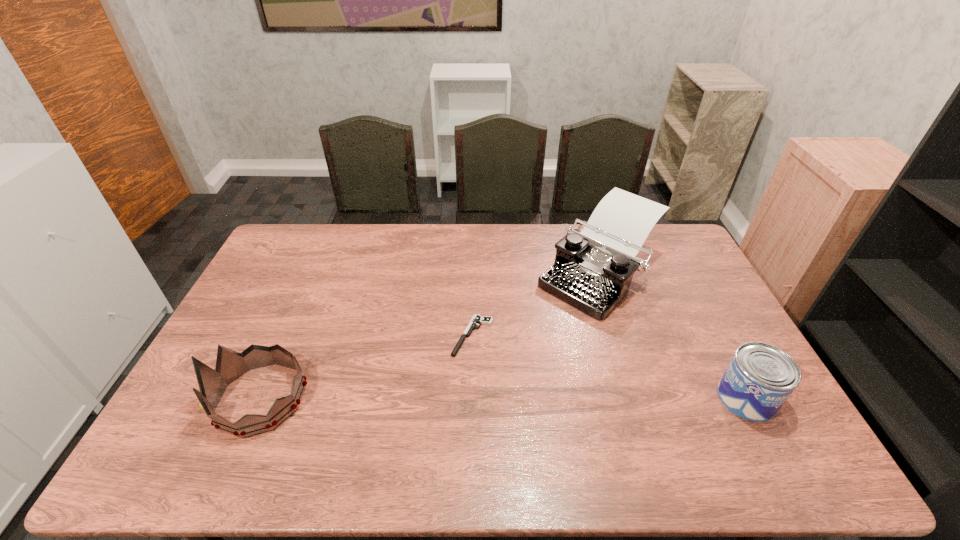
Image resolution: width=960 pixels, height=540 pixels. Find the location of `object present at the near right corner`. object present at the near right corner is located at coordinates (759, 379).

This screenshot has height=540, width=960. Identify the location of vacant area at the far edge of the desktop. (552, 261).

Find the location of a particular element. Image resolution: width=960 pixels, height=540 pixels. blank space at the near edge is located at coordinates (572, 420).

This screenshot has width=960, height=540. In the image, there is a desktop. Find the location of `vacant space at the right edge`. vacant space at the right edge is located at coordinates (667, 299).

You are a GUI agent. You are given a task and a screenshot of the screen. Output one action in this format:
    pyautogui.click(x=<x>, y=<y>)
    Task: Click on the vacant space at the far left corner of the desktop
    The height and width of the screenshot is (540, 960).
    Given the screenshot: What is the action you would take?
    pos(283,256)

This screenshot has height=540, width=960. Identify the location of free space at the far right corner of the desktop. (671, 230).

The height and width of the screenshot is (540, 960). I want to click on free spot between the tiara and the shortest object, so click(367, 367).

This screenshot has width=960, height=540. In order to click on vacant area between the tallest object and the pistol in this screenshot , I will do `click(536, 305)`.

Where is `vacant space that is in between the third tallest object and the leftmost object`? This screenshot has width=960, height=540. vacant space that is in between the third tallest object and the leftmost object is located at coordinates (503, 398).

Find the location of `vacant area that lies between the shortest object and the can`. vacant area that lies between the shortest object and the can is located at coordinates (610, 367).